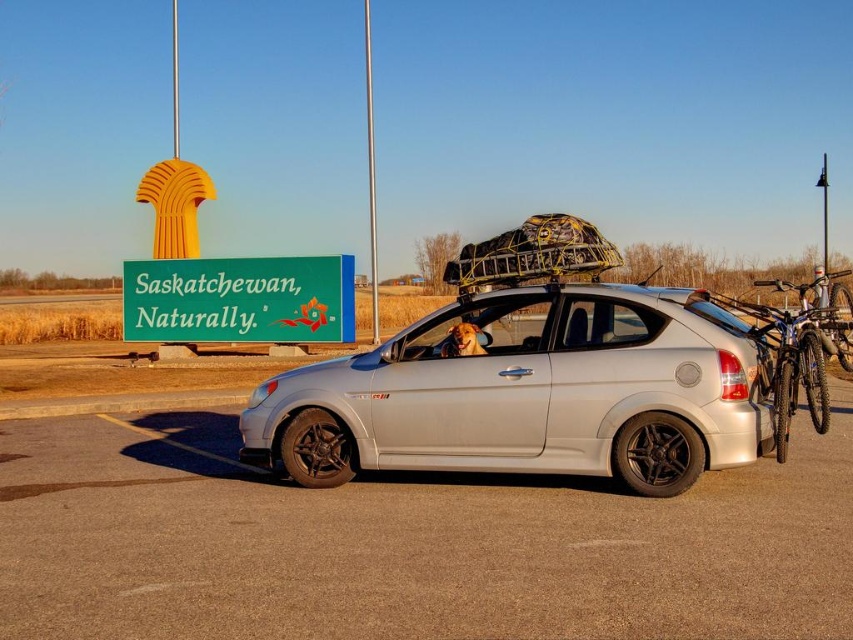
Does green plastic sign at upper center have a lesser width compared to blue metallic bicycle at right?

Yes, green plastic sign at upper center is thinner than blue metallic bicycle at right.

Where is `green plastic sign at upper center`? green plastic sign at upper center is located at coordinates (239, 300).

Where is `green plastic sign at upper center`? green plastic sign at upper center is located at coordinates (239, 300).

Between point (555, 445) and point (196, 324), which one is positioned behind?

Positioned behind is point (196, 324).

I want to click on silver metallic hatchback at center, so click(x=527, y=392).

Describe the element at coordinates (527, 392) in the screenshot. The height and width of the screenshot is (640, 853). I see `silver metallic hatchback at center` at that location.

Is silver metallic hatchback at center to the right of blue metallic bicycle at right from the viewer's perspective?

Incorrect, silver metallic hatchback at center is not on the right side of blue metallic bicycle at right.

What do you see at coordinates (527, 392) in the screenshot?
I see `silver metallic hatchback at center` at bounding box center [527, 392].

I want to click on silver metallic hatchback at center, so click(527, 392).